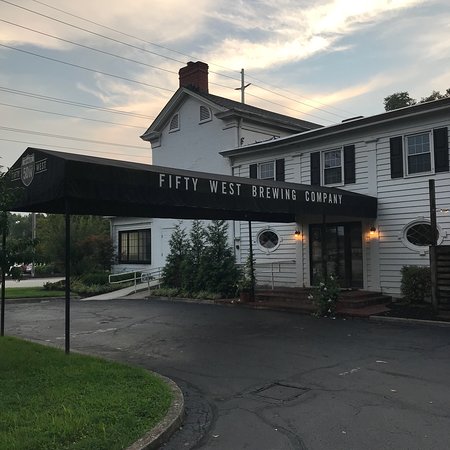
Find the location of a particular element. The width and height of the screenshot is (450, 450). windows is located at coordinates (134, 246), (260, 236), (428, 234), (417, 159), (315, 163), (274, 175), (203, 112), (168, 123).